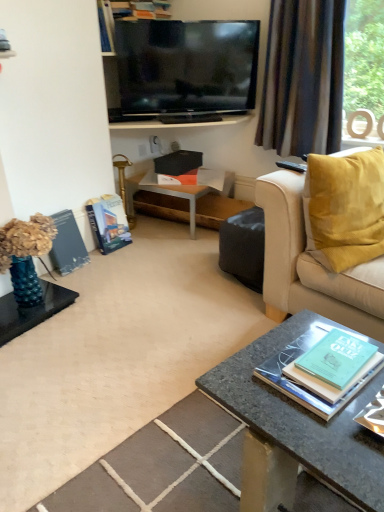
Where is `vacant space positioned to the left of beige fabric couch at right`? Image resolution: width=384 pixels, height=512 pixels. vacant space positioned to the left of beige fabric couch at right is located at coordinates (180, 318).